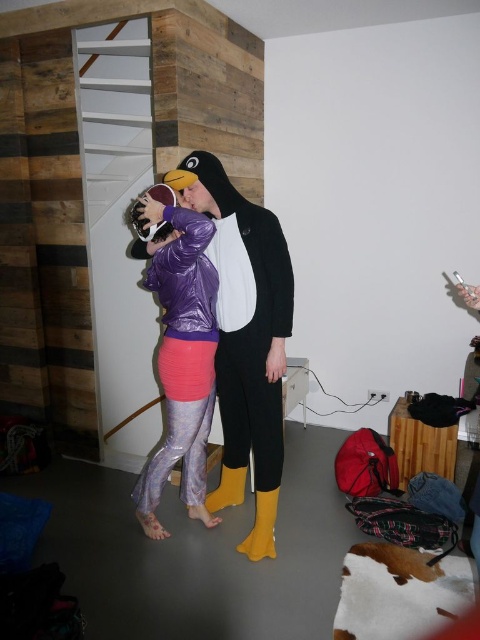
Is point (175, 362) positioned in front of point (233, 468)?

Yes, it is in front of point (233, 468).

Does shiny purple jacket at center appear over yellow rubber boot at center?

Yes, shiny purple jacket at center is above yellow rubber boot at center.

Between point (177, 225) and point (233, 490), which one is positioned behind?

Positioned behind is point (233, 490).

Locate an element on the screen. shiny purple jacket at center is located at coordinates (182, 356).

Is the position of matte purple jacket at center more distant than that of yellow rubber boot at center?

No, matte purple jacket at center is closer to the viewer.

Does matte purple jacket at center have a greater width compared to yellow rubber boot at center?

Yes, matte purple jacket at center is wider than yellow rubber boot at center.

Identify the location of matte purple jacket at center. (244, 314).

Find the location of a particular element. matte purple jacket at center is located at coordinates pyautogui.click(x=244, y=314).

Between yellow rubber boot at lower center and yellow rubber boot at center, which one is positioned higher?

Positioned higher is yellow rubber boot at center.

Measure the distance between point (252, 552) and camera.

They are 2.46 meters apart.

You are a GUI agent. You are given a task and a screenshot of the screen. Output one action in this format:
    pyautogui.click(x=<x>, y=<y>)
    Task: Click on the yellow rubber boot at lower center
    
    Given the screenshot: What is the action you would take?
    pyautogui.click(x=262, y=528)